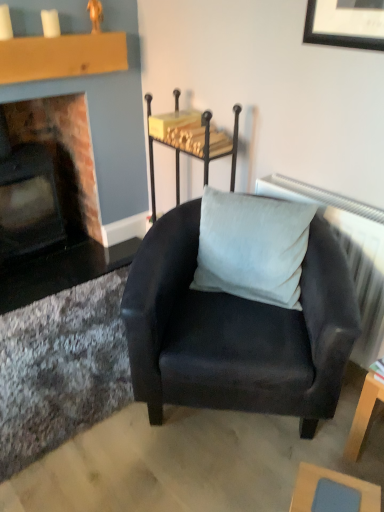
Question: From their relative heights in the image, would you say metallic black table at upper center, which is the 1th table in back-to-front order, is taller or shorter than light blue fabric table at lower right, which appears as the second table when viewed from the left?

Choices:
 (A) short
 (B) tall

Answer: (B)

Question: Is metallic black table at upper center, placed as the 3th table when sorted from bottom to top, in front of or behind light blue fabric table at lower right, placed as the 3th table when sorted from top to bottom, in the image?

Choices:
 (A) front
 (B) behind

Answer: (B)

Question: Estimate the real-world distances between objects in this image. Which object is closer to the light blue fabric table at lower right, the second table viewed from the right?

Choices:
 (A) wooden table at lower right, which appears as the second table when ordered from the bottom
 (B) suede-like gray pillow at center
 (C) gray fabric radiator at upper right
 (D) metallic black table at upper center, the third table in the front-to-back sequence
 (E) suede black armchair at center

Answer: (A)

Question: Which is nearer to the suede-like gray pillow at center?

Choices:
 (A) gray fabric radiator at upper right
 (B) wooden table at lower right, the 2th table from the back
 (C) matte brick fireplace at left
 (D) metallic black table at upper center, which is the 1th table in back-to-front order
 (E) suede black armchair at center

Answer: (E)